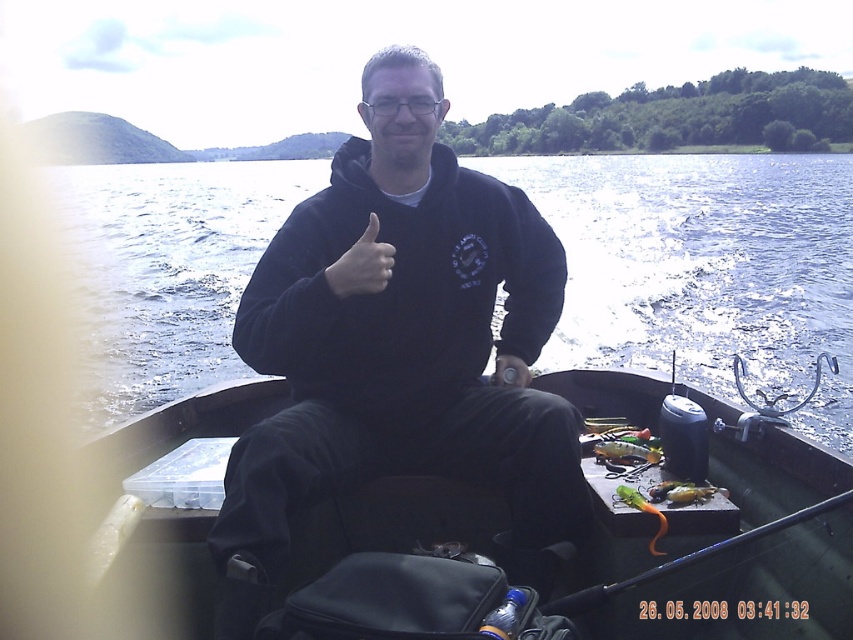
Consider the image. Who is more distant from viewer, (643, 221) or (222, 593)?

Point (643, 221)

Measure the distance between point (x=834, y=403) and camera.

Point (x=834, y=403) is 20.93 feet from camera.

Is point (721, 273) less distant than point (712, 404)?

No, (721, 273) is further to viewer.

Identify the location of clear water at center. (704, 268).

Is black matte boat at center to the left of orange rubber fishing pole at center from the viewer's perspective?

Indeed, black matte boat at center is positioned on the left side of orange rubber fishing pole at center.

Which is in front, point (341, 564) or point (596, 605)?

Point (341, 564) is in front.

You are a GUI agent. You are given a task and a screenshot of the screen. Output one action in this format:
    pyautogui.click(x=<x>, y=<y>)
    Task: Click on the black matte boat at center
    
    Given the screenshot: What is the action you would take?
    pyautogui.click(x=498, y=536)

Is point (416, 456) farther from camera compared to point (573, 609)?

Yes.

Is black matte hoodie at center smaller than orange rubber fishing pole at center?

No.

Who is more distant from viewer, (387, 280) or (743, 544)?

Point (387, 280)

This screenshot has height=640, width=853. I want to click on black matte hoodie at center, so click(x=402, y=333).